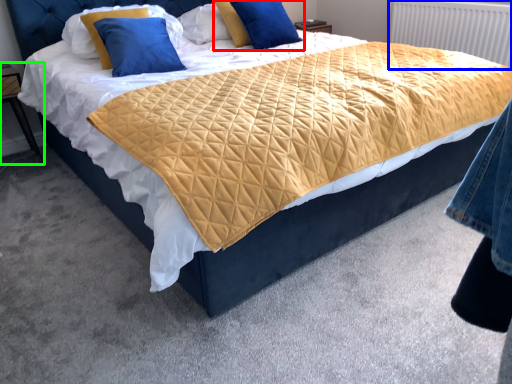
Question: Which is nearer to the pillow (highlighted by a red box)? radiator (highlighted by a blue box) or nightstand (highlighted by a green box).

Choices:
 (A) radiator
 (B) nightstand

Answer: (A)